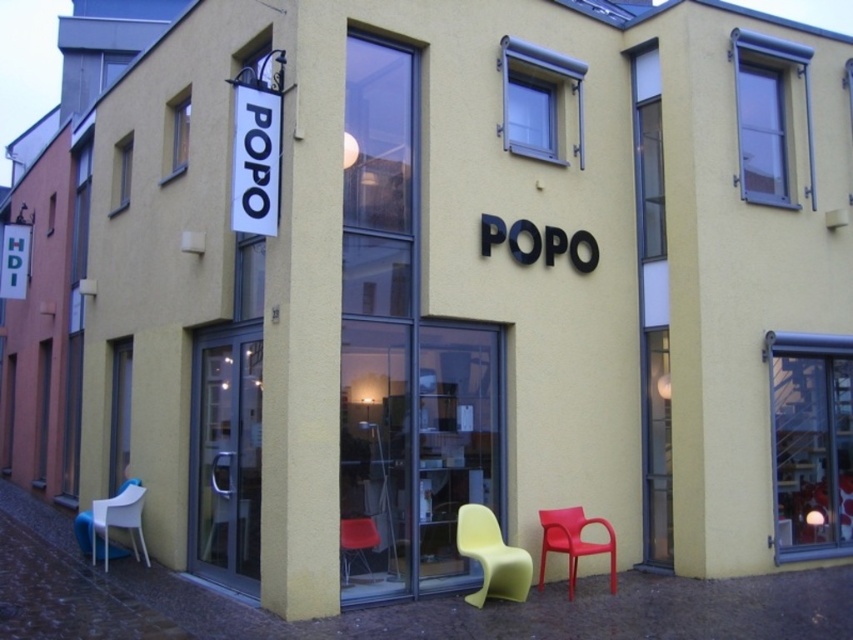
Between white plastic chair at lower left and matte plastic chair at lower right, which one has less height?

With less height is matte plastic chair at lower right.

Who is higher up, white plastic chair at lower left or matte plastic chair at lower right?

white plastic chair at lower left is above.

Is point (102, 508) farther from camera compared to point (549, 529)?

Yes, point (102, 508) is farther from viewer.

Find the location of `white plastic chair at lower left`. white plastic chair at lower left is located at coordinates (111, 522).

Can you confirm if matte yellow plastic chair at lower center is positioned below matte orange chair at center?

Correct, matte yellow plastic chair at lower center is located below matte orange chair at center.

Is matte yellow plastic chair at lower center to the left of matte orange chair at center from the viewer's perspective?

In fact, matte yellow plastic chair at lower center is to the right of matte orange chair at center.

Is point (486, 544) less distant than point (344, 582)?

No.

Locate an element on the screen. The height and width of the screenshot is (640, 853). matte yellow plastic chair at lower center is located at coordinates (491, 556).

Describe the element at coordinates (573, 541) in the screenshot. I see `matte plastic chair at lower right` at that location.

Which of these two, matte plastic chair at lower right or matte orange chair at center, stands shorter?

matte orange chair at center

Who is more distant from viewer, (573,522) or (358,518)?

Point (573,522)

This screenshot has width=853, height=640. I want to click on matte plastic chair at lower right, so click(573, 541).